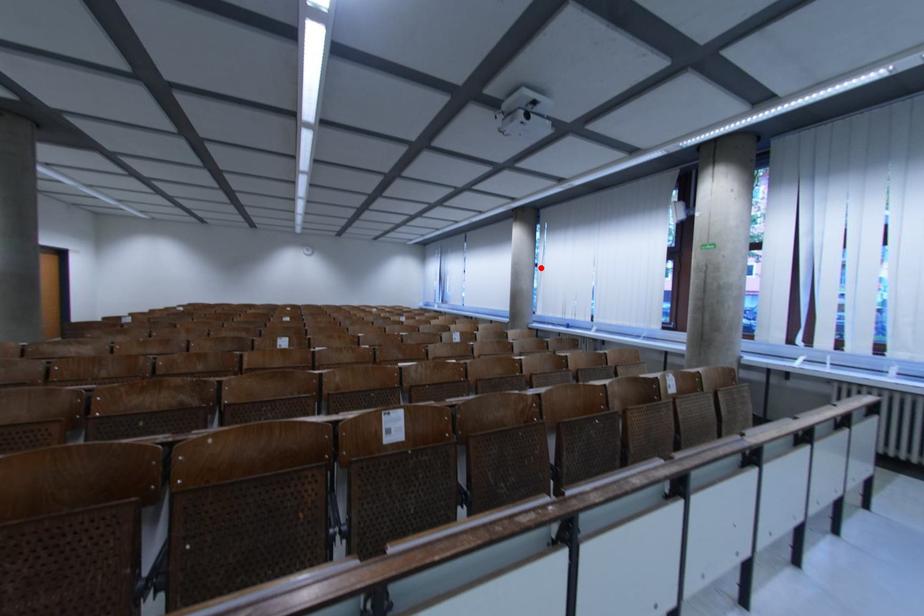
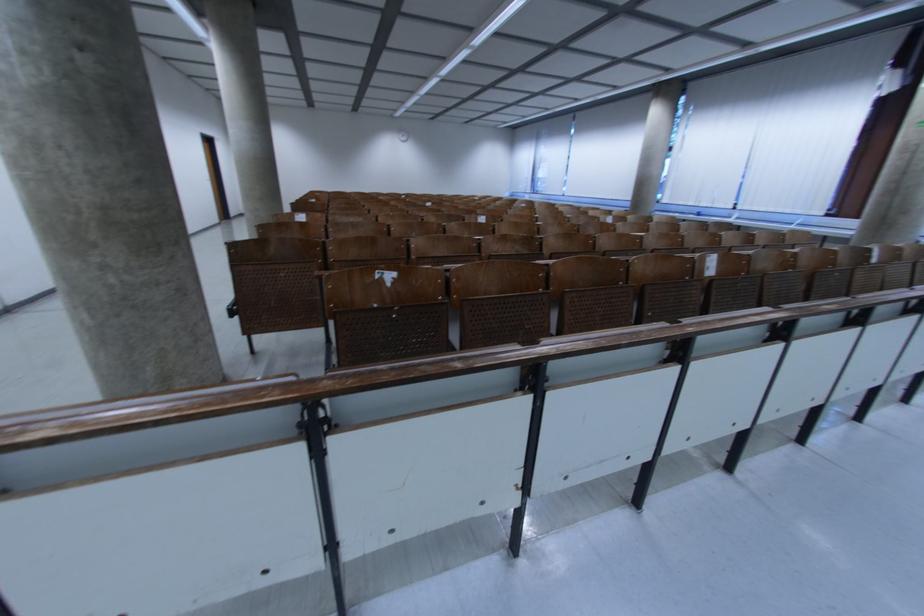
Question: A red point is marked in image1. In image2, is the corresponding 3D point closer to the camera or farther? Reply with the corresponding letter.

Choices:
 (A) The corresponding 3D point is closer.
 (B) The corresponding 3D point is farther.

Answer: (B)